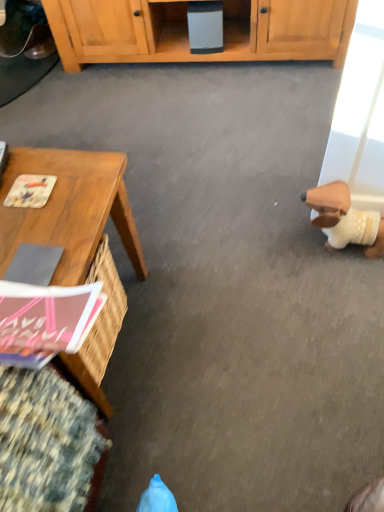
Describe the element at coordinates (30, 191) in the screenshot. This screenshot has height=512, width=384. I see `printed paper magazine at left, which appears as the 1th magazine when viewed from the top` at that location.

I want to click on wooden desk at left, so click(70, 210).

From a real-world perspective, is pink matte magazine at lower left, the second magazine when ordered from back to front, above or below wooden desk at left?

pink matte magazine at lower left, the second magazine when ordered from back to front, is above wooden desk at left.

Where is `magazine in front of the wooden desk at left`? The image size is (384, 512). magazine in front of the wooden desk at left is located at coordinates (44, 321).

Could you tell me if pink matte magazine at lower left, the second magazine when ordered from back to front, is facing wooden desk at left?

No, pink matte magazine at lower left, the second magazine when ordered from back to front, is not oriented towards wooden desk at left.

How many degrees apart are the facing directions of pink matte magazine at lower left, which is the second magazine from top to bottom, and wooden desk at left?

The angular difference between pink matte magazine at lower left, which is the second magazine from top to bottom, and wooden desk at left is 3.9 degrees.

Locate an element on the screen. This screenshot has height=512, width=384. toy behind the pink matte magazine at lower left, which is the second magazine from top to bottom is located at coordinates (343, 219).

Considering the positions of objects brown plush toy at right and pink matte magazine at lower left, positioned as the first magazine in front-to-back order, in the image provided, who is more to the right, brown plush toy at right or pink matte magazine at lower left, positioned as the first magazine in front-to-back order,?

From the viewer's perspective, brown plush toy at right appears more on the right side.

From the image's perspective, is brown plush toy at right under pink matte magazine at lower left, which ranks as the first magazine in bottom-to-top order?

Incorrect, from the image's perspective, brown plush toy at right is higher than pink matte magazine at lower left, which ranks as the first magazine in bottom-to-top order.

From a real-world perspective, which is physically below, brown plush toy at right or pink matte magazine at lower left, which is the second magazine from top to bottom?

In real-world perspective, brown plush toy at right is lower.

Considering the sizes of brown plush toy at right and printed paper magazine at left, the 2th magazine viewed from the front, in the image, is brown plush toy at right taller or shorter than printed paper magazine at left, the 2th magazine viewed from the front,?

In the image, brown plush toy at right appears to be taller than printed paper magazine at left, the 2th magazine viewed from the front.

Between brown plush toy at right and printed paper magazine at left, the 1th magazine when ordered from back to front, which one has smaller width?

Thinner between the two is printed paper magazine at left, the 1th magazine when ordered from back to front.

Considering the relative positions of brown plush toy at right and printed paper magazine at left, the 1th magazine when ordered from back to front, in the image provided, is brown plush toy at right to the left or to the right of printed paper magazine at left, the 1th magazine when ordered from back to front,?

From the image, it's evident that brown plush toy at right is to the right of printed paper magazine at left, the 1th magazine when ordered from back to front.

The width and height of the screenshot is (384, 512). Identify the location of toy on the right of printed paper magazine at left, which appears as the 1th magazine when viewed from the top. (343, 219).

Between point (79, 343) and point (51, 177), which one is positioned behind?

The point (51, 177) is more distant.

From a real-world perspective, is pink matte magazine at lower left, which is the second magazine from top to bottom, beneath printed paper magazine at left, the 1th magazine when ordered from back to front?

No, from a real-world perspective, pink matte magazine at lower left, which is the second magazine from top to bottom, is not under printed paper magazine at left, the 1th magazine when ordered from back to front.

From the image's perspective, between pink matte magazine at lower left, the second magazine when ordered from back to front, and printed paper magazine at left, which is the 2th magazine in bottom-to-top order, which one is located above?

printed paper magazine at left, which is the 2th magazine in bottom-to-top order, appears higher in the image.

Consider the image. Is printed paper magazine at left, the 2th magazine viewed from the front, facing away from brown plush toy at right?

No, brown plush toy at right is not at the back of printed paper magazine at left, the 2th magazine viewed from the front.

You are a GUI agent. You are given a task and a screenshot of the screen. Output one action in this format:
    pyautogui.click(x=<x>, y=<y>)
    Task: Click on the toy that is under the printed paper magazine at left, which appears as the 1th magazine when viewed from the top (from a real-world perspective)
    This screenshot has width=384, height=512.
    Given the screenshot: What is the action you would take?
    pyautogui.click(x=343, y=219)

What's the angular difference between printed paper magazine at left, the 1th magazine when ordered from back to front, and brown plush toy at right's facing directions?

84.6 degrees.

Can you confirm if printed paper magazine at left, which is the 2th magazine in bottom-to-top order, is taller than brown plush toy at right?

No, printed paper magazine at left, which is the 2th magazine in bottom-to-top order, is not taller than brown plush toy at right.

Is printed paper magazine at left, the 1th magazine when ordered from back to front, placed right next to wooden desk at left?

No, printed paper magazine at left, the 1th magazine when ordered from back to front, is not beside wooden desk at left.

In terms of height, does printed paper magazine at left, the 1th magazine when ordered from back to front, look taller or shorter compared to wooden desk at left?

Considering their sizes, printed paper magazine at left, the 1th magazine when ordered from back to front, has less height than wooden desk at left.

Does point (37, 204) appear closer or farther from the camera than point (86, 196)?

Point (37, 204).

Based on their positions, is printed paper magazine at left, which is the 2th magazine in bottom-to-top order, located to the left or right of wooden desk at left?

printed paper magazine at left, which is the 2th magazine in bottom-to-top order, is positioned on wooden desk at left's right side.

Can you confirm if brown plush toy at right is wider than wooden desk at left?

In fact, brown plush toy at right might be narrower than wooden desk at left.

Is brown plush toy at right aimed at wooden desk at left?

No, brown plush toy at right is not aimed at wooden desk at left.

Which object is positioned more to the right, brown plush toy at right or wooden desk at left?

brown plush toy at right.

Identify the location of magazine below the wooden desk at left (from the image's perspective). (44, 321).

From a real-world perspective, which magazine is the 2nd one above the brown plush toy at right? Please provide its 2D coordinates.

[(44, 321)]

From the picture: When comparing their distances from brown plush toy at right, does printed paper magazine at left, which appears as the 1th magazine when viewed from the top, or pink matte magazine at lower left, which ranks as the first magazine in bottom-to-top order, seem further?

pink matte magazine at lower left, which ranks as the first magazine in bottom-to-top order, lies further to brown plush toy at right than the other object.

Looking at the image, which one is located further to printed paper magazine at left, the 2th magazine viewed from the front, brown plush toy at right or pink matte magazine at lower left, which is the second magazine from top to bottom?

brown plush toy at right.

When comparing their distances from printed paper magazine at left, which appears as the 1th magazine when viewed from the top, does wooden desk at left or pink matte magazine at lower left, positioned as the first magazine in front-to-back order, seem further?

Based on the image, pink matte magazine at lower left, positioned as the first magazine in front-to-back order, appears to be further to printed paper magazine at left, which appears as the 1th magazine when viewed from the top.

Which object lies nearer to the anchor point printed paper magazine at left, which appears as the 1th magazine when viewed from the top, pink matte magazine at lower left, the second magazine when ordered from back to front, or wooden desk at left?

The object closer to printed paper magazine at left, which appears as the 1th magazine when viewed from the top, is wooden desk at left.

Estimate the real-world distances between objects in this image. Which object is further from pink matte magazine at lower left, positioned as the first magazine in front-to-back order, printed paper magazine at left, the 1th magazine when ordered from back to front, or brown plush toy at right?

brown plush toy at right is positioned further to the anchor pink matte magazine at lower left, positioned as the first magazine in front-to-back order.

In the scene shown: Looking at the image, which one is located closer to brown plush toy at right, pink matte magazine at lower left, which is the second magazine from top to bottom, or printed paper magazine at left, the 2th magazine viewed from the front?

The object closer to brown plush toy at right is printed paper magazine at left, the 2th magazine viewed from the front.

When comparing their distances from printed paper magazine at left, which is the 2th magazine in bottom-to-top order, does wooden desk at left or brown plush toy at right seem closer?

wooden desk at left is closer to printed paper magazine at left, which is the 2th magazine in bottom-to-top order.

Based on their spatial positions, is wooden desk at left or brown plush toy at right closer to pink matte magazine at lower left, positioned as the first magazine in front-to-back order?

Based on the image, wooden desk at left appears to be nearer to pink matte magazine at lower left, positioned as the first magazine in front-to-back order.

I want to click on magazine between printed paper magazine at left, the 1th magazine when ordered from back to front, and brown plush toy at right, in the horizontal direction, so click(x=44, y=321).

At what (x,y) coordinates should I click in order to perform the action: click on desk between pink matte magazine at lower left, which is the second magazine from top to bottom, and printed paper magazine at left, which appears as the 1th magazine when viewed from the top, from front to back. Please return your answer as a coordinate pair (x, y). Looking at the image, I should click on (70, 210).